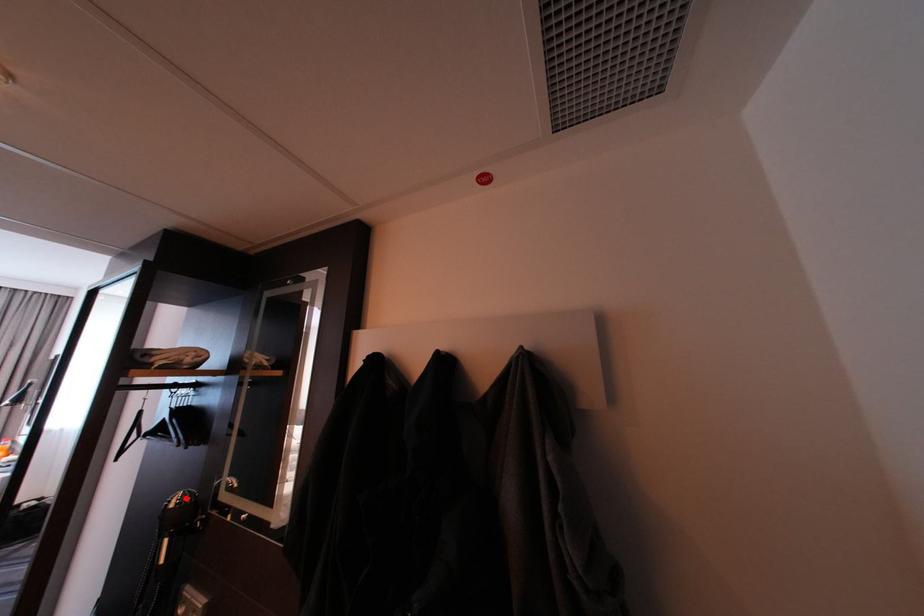
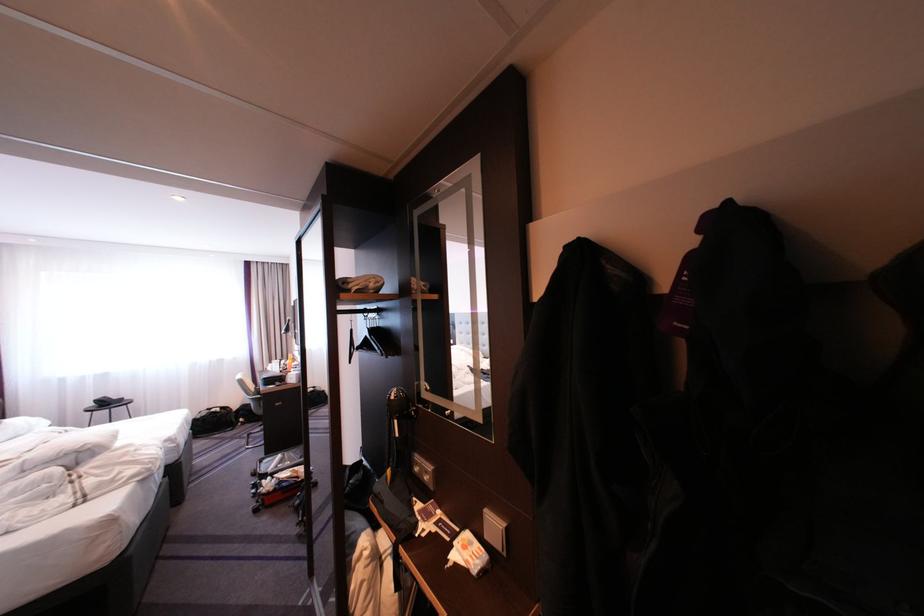
Locate, in the second image, the point that corresponds to the highlighted location in the first image.

(404, 392)